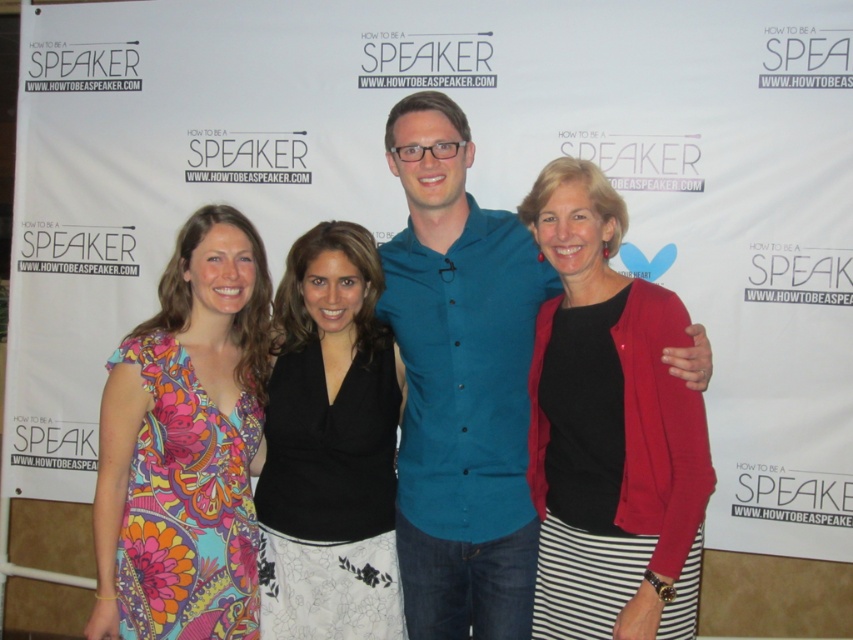
Question: From the image, what is the correct spatial relationship of teal button-up shirt at center in relation to floral print dress at left?

Choices:
 (A) right
 (B) left

Answer: (A)

Question: Is black matte shirt at center wider than black jersey at center?

Choices:
 (A) no
 (B) yes

Answer: (B)

Question: Which of the following is the closest to the observer?

Choices:
 (A) (438, 460)
 (B) (376, 332)
 (C) (149, 326)

Answer: (C)

Question: Which object is positioned closest to the black jersey at center?

Choices:
 (A) printed fabric dress at left
 (B) floral print dress at left
 (C) teal button-up shirt at center
 (D) black matte shirt at center

Answer: (A)

Question: Is black matte shirt at center positioned before floral print dress at left?

Choices:
 (A) no
 (B) yes

Answer: (B)

Question: Estimate the real-world distances between objects in this image. Which object is farther from the floral print dress at left?

Choices:
 (A) teal button-up shirt at center
 (B) black matte shirt at center

Answer: (B)